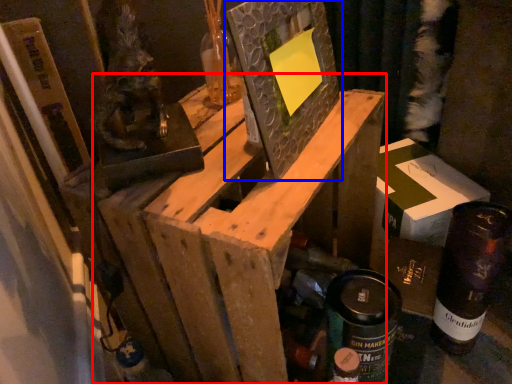
Question: Which object appears closest to the camera in this image, furniture (highlighted by a red box) or picture frame (highlighted by a blue box)?

Choices:
 (A) furniture
 (B) picture frame

Answer: (A)